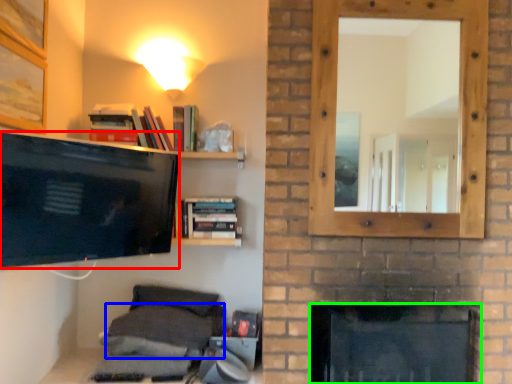
Question: Considering the real-world distances, which object is closest to television (highlighted by a red box)? pillow (highlighted by a blue box) or fireplace (highlighted by a green box).

Choices:
 (A) pillow
 (B) fireplace

Answer: (A)